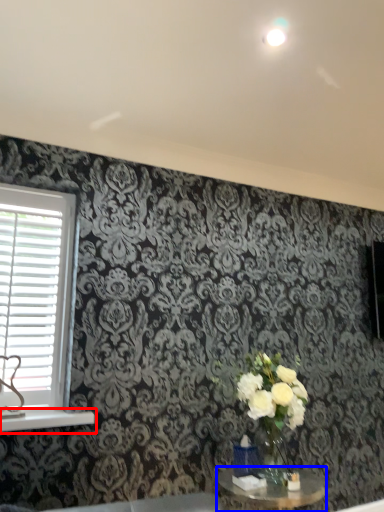
Question: Which point is closer to the camera, window sill (highlighted by a red box) or table (highlighted by a blue box)?

Choices:
 (A) window sill
 (B) table

Answer: (B)